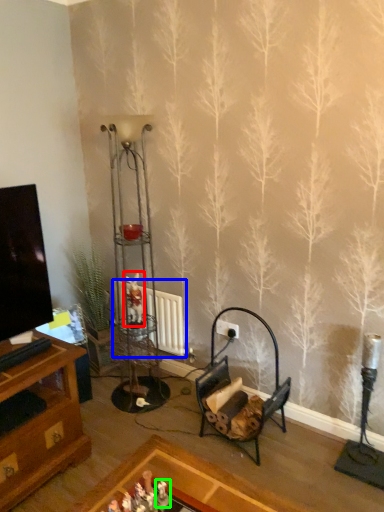
Question: Which object is positioned closest to toy (highlighted by a red box)? Select from radiator (highlighted by a blue box) and toy (highlighted by a green box).

Choices:
 (A) radiator
 (B) toy

Answer: (A)